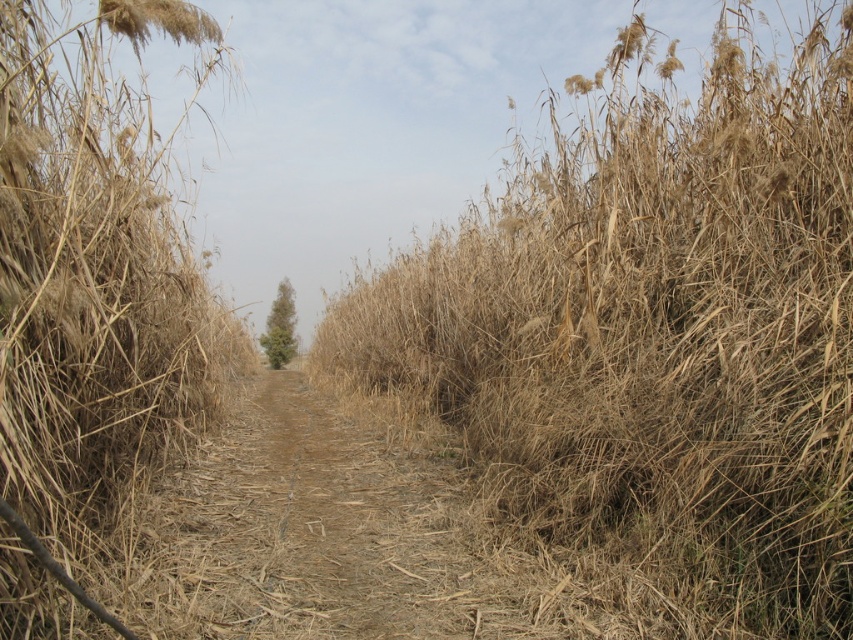
You are a hiker walking along the narrow pathway between the tall dry reeds. You notice two items at the center of the path ahead of you. One is dry grass at center and the other is dry straw at center. Which item is located above the other?

The dry grass at center is positioned over dry straw at center, so the dry grass at center is above the dry straw at center.

You are a hiker trying to walk through the narrow pathway. You notice the dry straw at center and the green leafy tree at center. Which object is narrower in width?

The dry straw at center is narrower in width than the green leafy tree at center.

You are a hiker trying to cross the narrow pathway. You notice two materials on the ground at the center of the path. Which one is wider in width between the dry grass at center and the dry straw at center?

The dry grass at center is wider than the dry straw at center.